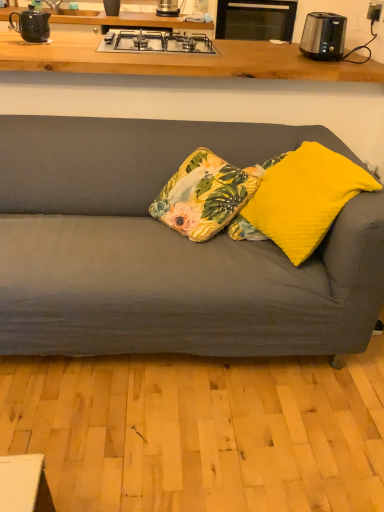
Based on the photo, measure the distance between satin silver toaster at upper center, the first kitchen appliance from the back, and camera.

satin silver toaster at upper center, the first kitchen appliance from the back, is 9.00 feet from camera.

Image resolution: width=384 pixels, height=512 pixels. What do you see at coordinates (205, 195) in the screenshot? I see `floral fabric cushion at center, the third pillow positioned from the right` at bounding box center [205, 195].

What do you see at coordinates (323, 36) in the screenshot? Image resolution: width=384 pixels, height=512 pixels. I see `polished stainless steel toaster at upper right, which is the second kitchen appliance in left-to-right order` at bounding box center [323, 36].

Locate an element on the screen. matte black teapot at upper left is located at coordinates (31, 25).

The width and height of the screenshot is (384, 512). I want to click on yellow soft cushion at right, the third pillow when ordered from left to right, so click(x=305, y=198).

Find the location of a particular element. Image resolution: width=384 pixels, height=512 pixels. satin silver toaster at upper center, the first kitchen appliance from the back is located at coordinates [167, 8].

Is satin silver toaster at upper center, marked as the 2th kitchen appliance in a front-to-back arrangement, behind floral fabric cushion at center, the third pillow positioned from the right?

Yes, it is behind floral fabric cushion at center, the third pillow positioned from the right.

Is satin silver toaster at upper center, which is the 1th kitchen appliance from left to right, directly adjacent to floral fabric cushion at center, which ranks as the first pillow in left-to-right order?

No, satin silver toaster at upper center, which is the 1th kitchen appliance from left to right, is not next to floral fabric cushion at center, which ranks as the first pillow in left-to-right order.

Who is shorter, satin silver toaster at upper center, marked as the 2th kitchen appliance in a front-to-back arrangement, or floral fabric cushion at center, the third pillow positioned from the right?

Standing shorter between the two is satin silver toaster at upper center, marked as the 2th kitchen appliance in a front-to-back arrangement.

From the image's perspective, starting from the floral fabric cushion at center, the third pillow positioned from the right, which kitchen appliance is the 2nd one above? Please provide its 2D coordinates.

[(167, 8)]

Is yellow fabric pillow at center, which is the second pillow from left to right, aimed at yellow soft cushion at right, placed as the first pillow when sorted from right to left?

Yes, yellow fabric pillow at center, which is the second pillow from left to right, faces towards yellow soft cushion at right, placed as the first pillow when sorted from right to left.

Between yellow fabric pillow at center, the 2th pillow from the right, and yellow soft cushion at right, the third pillow when ordered from left to right, which one has less height?

With less height is yellow fabric pillow at center, the 2th pillow from the right.

Locate an element on the screen. This screenshot has width=384, height=512. the 2nd pillow in front when counting from the yellow fabric pillow at center, the 2th pillow from the right is located at coordinates (305, 198).

Is yellow fabric pillow at center, the 2th pillow from the right, further to camera compared to yellow soft cushion at right, placed as the first pillow when sorted from right to left?

Yes, it is.

Is floral fabric cushion at center, which ranks as the first pillow in left-to-right order, positioned with its back to silver metallic gas stove at upper center?

That's not correct — floral fabric cushion at center, which ranks as the first pillow in left-to-right order, is not looking away from silver metallic gas stove at upper center.

The width and height of the screenshot is (384, 512). Find the location of `gas stove to the left of floral fabric cushion at center, which ranks as the first pillow in left-to-right order`. gas stove to the left of floral fabric cushion at center, which ranks as the first pillow in left-to-right order is located at coordinates (156, 42).

From a real-world perspective, is floral fabric cushion at center, which ranks as the first pillow in left-to-right order, below silver metallic gas stove at upper center?

Correct, in the physical world, floral fabric cushion at center, which ranks as the first pillow in left-to-right order, is lower than silver metallic gas stove at upper center.

Is floral fabric cushion at center, which ranks as the first pillow in left-to-right order, taller or shorter than silver metallic gas stove at upper center?

Clearly, floral fabric cushion at center, which ranks as the first pillow in left-to-right order, is taller compared to silver metallic gas stove at upper center.

Looking at this image, from a real-world perspective, does matte black teapot at upper left sit lower than satin silver toaster at upper center, which ranks as the 2th kitchen appliance in right-to-left order?

Actually, matte black teapot at upper left is physically above satin silver toaster at upper center, which ranks as the 2th kitchen appliance in right-to-left order, in the real world.

This screenshot has width=384, height=512. What are the coordinates of `appliance to the left of satin silver toaster at upper center, marked as the 2th kitchen appliance in a front-to-back arrangement` in the screenshot? It's located at (31, 25).

Is matte black teapot at upper left located outside satin silver toaster at upper center, which is the 1th kitchen appliance from left to right?

Yes.

Which is more to the left, matte black teapot at upper left or satin silver toaster at upper center, which is the 1th kitchen appliance from left to right?

Positioned to the left is matte black teapot at upper left.

Considering the points (228, 182) and (234, 231), which point is in front, point (228, 182) or point (234, 231)?

The point (234, 231) is in front.

From a real-world perspective, is floral fabric cushion at center, the third pillow positioned from the right, on top of yellow fabric pillow at center, the 2th pillow from the right?

Incorrect, from a real-world perspective, floral fabric cushion at center, the third pillow positioned from the right, is lower than yellow fabric pillow at center, the 2th pillow from the right.

Would you consider floral fabric cushion at center, the third pillow positioned from the right, to be distant from yellow fabric pillow at center, the 2th pillow from the right?

Actually, floral fabric cushion at center, the third pillow positioned from the right, and yellow fabric pillow at center, the 2th pillow from the right, are a little close together.

In terms of width, does floral fabric cushion at center, the third pillow positioned from the right, look wider or thinner when compared to yellow fabric pillow at center, which is the second pillow from left to right?

Considering their sizes, floral fabric cushion at center, the third pillow positioned from the right, looks slimmer than yellow fabric pillow at center, which is the second pillow from left to right.

Would you say floral fabric cushion at center, which ranks as the first pillow in left-to-right order, is outside satin silver toaster at upper center, the second kitchen appliance when ordered from bottom to top?

Yes, floral fabric cushion at center, which ranks as the first pillow in left-to-right order, is outside of satin silver toaster at upper center, the second kitchen appliance when ordered from bottom to top.

Which is in front, point (172, 186) or point (175, 8)?

The point (172, 186) is more forward.

From a real-world perspective, between floral fabric cushion at center, the third pillow positioned from the right, and satin silver toaster at upper center, which is the 1th kitchen appliance from left to right, who is vertically higher?

From a 3D spatial view, satin silver toaster at upper center, which is the 1th kitchen appliance from left to right, is above.

From the image's perspective, is floral fabric cushion at center, the third pillow positioned from the right, on satin silver toaster at upper center, which is the 1th kitchen appliance from left to right?

Incorrect, from the image's perspective, floral fabric cushion at center, the third pillow positioned from the right, is lower than satin silver toaster at upper center, which is the 1th kitchen appliance from left to right.

Between yellow soft cushion at right, the third pillow when ordered from left to right, and satin silver toaster at upper center, which ranks as the 2th kitchen appliance in right-to-left order, which one has smaller width?

Thinner between the two is satin silver toaster at upper center, which ranks as the 2th kitchen appliance in right-to-left order.

Looking at the image, does yellow soft cushion at right, the third pillow when ordered from left to right, seem bigger or smaller compared to satin silver toaster at upper center, the second kitchen appliance when ordered from bottom to top?

yellow soft cushion at right, the third pillow when ordered from left to right, is bigger than satin silver toaster at upper center, the second kitchen appliance when ordered from bottom to top.

Between yellow soft cushion at right, the third pillow when ordered from left to right, and satin silver toaster at upper center, the second kitchen appliance when ordered from bottom to top, which one is positioned behind?

satin silver toaster at upper center, the second kitchen appliance when ordered from bottom to top, is more distant.

How many degrees apart are the facing directions of yellow soft cushion at right, placed as the first pillow when sorted from right to left, and satin silver toaster at upper center, which is the 1th kitchen appliance from left to right?

The facing directions of yellow soft cushion at right, placed as the first pillow when sorted from right to left, and satin silver toaster at upper center, which is the 1th kitchen appliance from left to right, are 68 degrees apart.

There is a floral fabric cushion at center, which ranks as the first pillow in left-to-right order. Where is `the 2nd kitchen appliance above it (from the image's perspective)`? the 2nd kitchen appliance above it (from the image's perspective) is located at coordinates (167, 8).

Find the location of a particular element. The height and width of the screenshot is (512, 384). the 1st pillow located beneath the yellow soft cushion at right, the third pillow when ordered from left to right (from a real-world perspective) is located at coordinates (244, 230).

Estimate the real-world distances between objects in this image. Which object is further from matte black teapot at upper left, yellow fabric pillow at center, the 2th pillow from the right, or silver metallic gas stove at upper center?

yellow fabric pillow at center, the 2th pillow from the right, is further to matte black teapot at upper left.

Based on their spatial positions, is floral fabric cushion at center, which ranks as the first pillow in left-to-right order, or yellow fabric pillow at center, the 2th pillow from the right, further from polished stainless steel toaster at upper right, the first kitchen appliance when ordered from right to left?

Based on the image, yellow fabric pillow at center, the 2th pillow from the right, appears to be further to polished stainless steel toaster at upper right, the first kitchen appliance when ordered from right to left.

Which object lies further to the anchor point silver metallic gas stove at upper center, matte black teapot at upper left or floral fabric cushion at center, the third pillow positioned from the right?

floral fabric cushion at center, the third pillow positioned from the right, is further to silver metallic gas stove at upper center.

Estimate the real-world distances between objects in this image. Which object is further from matte black teapot at upper left, floral fabric cushion at center, which ranks as the first pillow in left-to-right order, or satin silver toaster at upper center, the first kitchen appliance from the back?

floral fabric cushion at center, which ranks as the first pillow in left-to-right order, lies further to matte black teapot at upper left than the other object.

Based on their spatial positions, is floral fabric cushion at center, which ranks as the first pillow in left-to-right order, or yellow fabric pillow at center, the 2th pillow from the right, further from yellow soft cushion at right, the third pillow when ordered from left to right?

floral fabric cushion at center, which ranks as the first pillow in left-to-right order, is positioned further to the anchor yellow soft cushion at right, the third pillow when ordered from left to right.

From the image, which object appears to be nearer to floral fabric cushion at center, the third pillow positioned from the right, satin silver toaster at upper center, which ranks as the 2th kitchen appliance in right-to-left order, or polished stainless steel toaster at upper right, placed as the 2th kitchen appliance when sorted from top to bottom?

polished stainless steel toaster at upper right, placed as the 2th kitchen appliance when sorted from top to bottom, is positioned closer to the anchor floral fabric cushion at center, the third pillow positioned from the right.

Considering their positions, is matte black teapot at upper left positioned closer to yellow fabric pillow at center, which is the second pillow from left to right, than floral fabric cushion at center, which ranks as the first pillow in left-to-right order?

Among the two, floral fabric cushion at center, which ranks as the first pillow in left-to-right order, is located nearer to yellow fabric pillow at center, which is the second pillow from left to right.

Estimate the real-world distances between objects in this image. Which object is further from satin silver toaster at upper center, marked as the 2th kitchen appliance in a front-to-back arrangement, silver metallic gas stove at upper center or floral fabric cushion at center, which ranks as the first pillow in left-to-right order?

Among the two, floral fabric cushion at center, which ranks as the first pillow in left-to-right order, is located further to satin silver toaster at upper center, marked as the 2th kitchen appliance in a front-to-back arrangement.

Where is `kitchen appliance between yellow fabric pillow at center, the 2th pillow from the right, and satin silver toaster at upper center, the second kitchen appliance when ordered from bottom to top, along the z-axis`? The image size is (384, 512). kitchen appliance between yellow fabric pillow at center, the 2th pillow from the right, and satin silver toaster at upper center, the second kitchen appliance when ordered from bottom to top, along the z-axis is located at coordinates (323, 36).

You are a GUI agent. You are given a task and a screenshot of the screen. Output one action in this format:
    pyautogui.click(x=<x>, y=<y>)
    Task: Click on the kitchen appliance between silver metallic gas stove at upper center and yellow soft cushion at right, the third pillow when ordered from left to right, vertically
    
    Given the screenshot: What is the action you would take?
    pyautogui.click(x=323, y=36)

In order to click on appliance located between polished stainless steel toaster at upper right, placed as the 2th kitchen appliance when sorted from top to bottom, and satin silver toaster at upper center, which is the 1th kitchen appliance from top to bottom, in the depth direction in this screenshot , I will do `click(31, 25)`.

You are a GUI agent. You are given a task and a screenshot of the screen. Output one action in this format:
    pyautogui.click(x=<x>, y=<y>)
    Task: Click on the gas stove located between yellow fabric pillow at center, the 2th pillow from the right, and satin silver toaster at upper center, which ranks as the 2th kitchen appliance in right-to-left order, in the depth direction
    
    Given the screenshot: What is the action you would take?
    pyautogui.click(x=156, y=42)